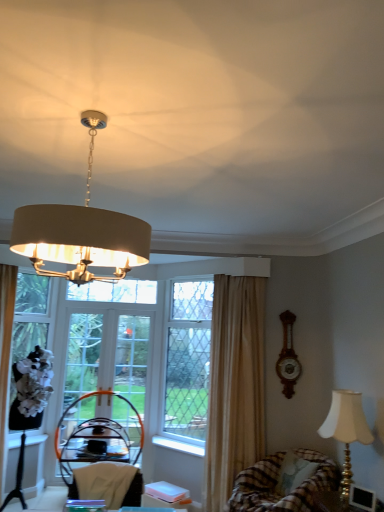
Identify the location of vacant space situated above matte beige lampshade at upper center, which is counted as the 2th lamp, starting from the right (from a real-world perspective). (107, 106).